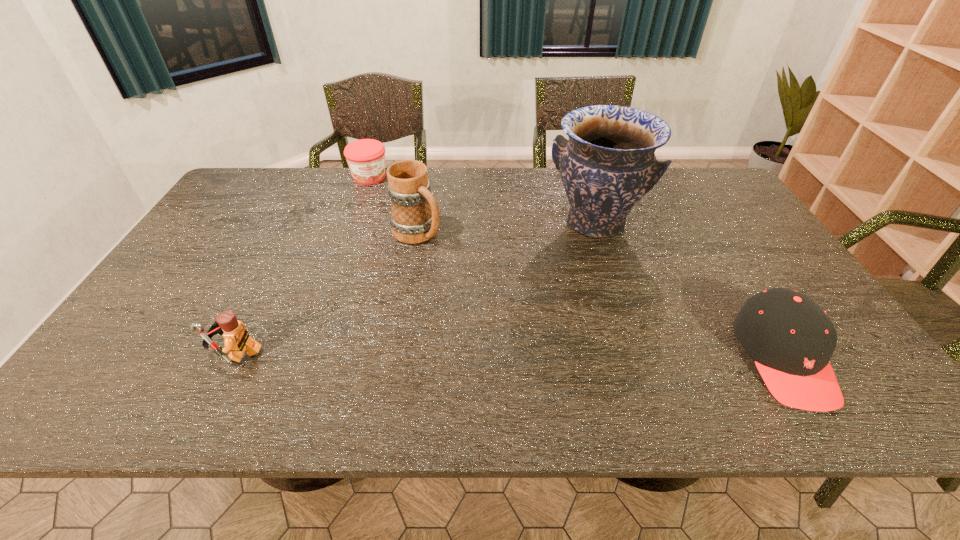
Identify the location of Lego. (237, 340).

This screenshot has height=540, width=960. Find the location of `the rightmost object`. the rightmost object is located at coordinates (791, 339).

This screenshot has height=540, width=960. In order to click on the third object from left to right in this screenshot , I will do `click(414, 219)`.

At what (x,y) coordinates should I click in order to perform the action: click on mug. Please return your answer as a coordinate pair (x, y). The height and width of the screenshot is (540, 960). Looking at the image, I should click on (414, 219).

The image size is (960, 540). I want to click on the second object from left to right, so tap(366, 157).

You are a GUI agent. You are given a task and a screenshot of the screen. Output one action in this format:
    pyautogui.click(x=<x>, y=<y>)
    Task: Click on the shortest object
    
    Given the screenshot: What is the action you would take?
    pyautogui.click(x=366, y=157)

Find the location of a particular element. This screenshot has height=540, width=960. the tallest object is located at coordinates (608, 164).

The width and height of the screenshot is (960, 540). I want to click on the second object from right to left, so click(x=608, y=164).

The height and width of the screenshot is (540, 960). Identify the location of vacant position located holding a crossbow in the hands of the Lego. (156, 353).

Identify the location of vacant space located holding a crossbow in the hands of the Lego. (110, 353).